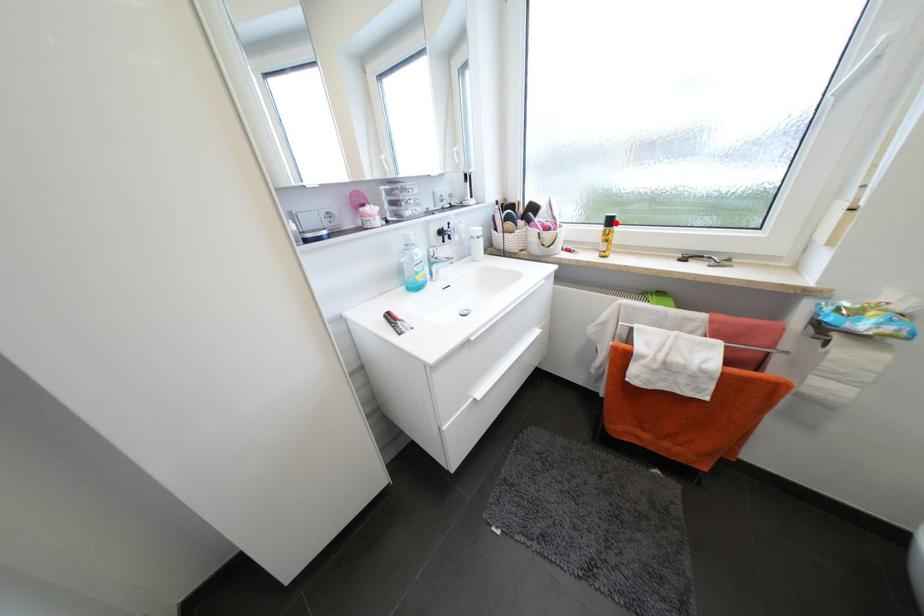
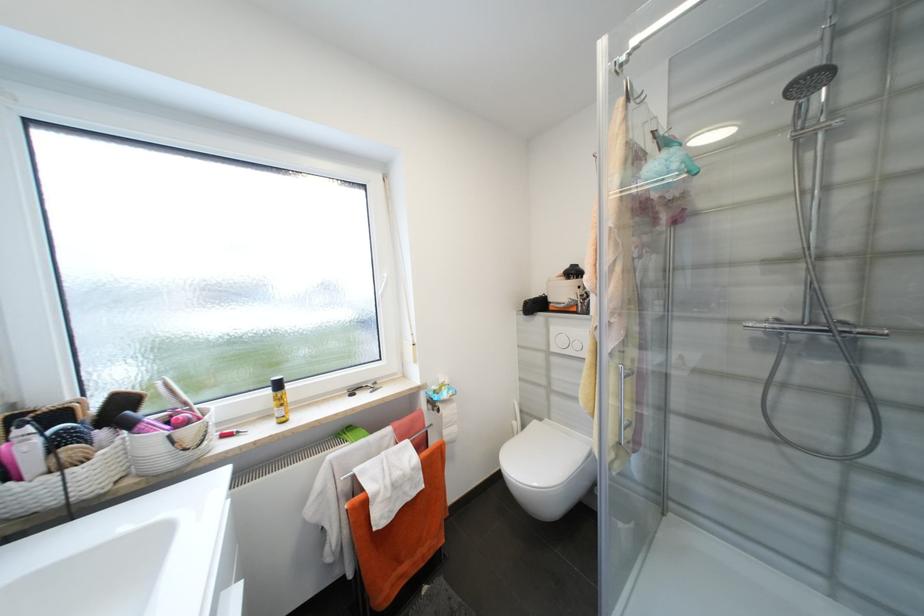
In the second image, find the point that corresponds to the highlighted location in the first image.

(284, 386)